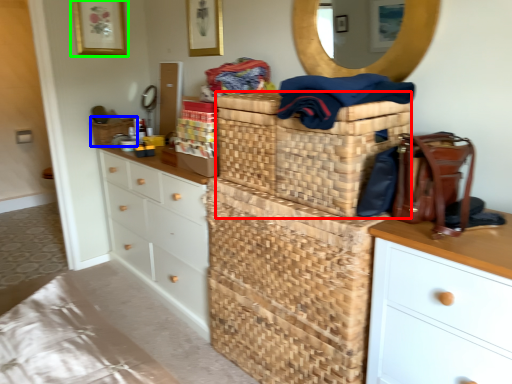
Question: Which object is positioned farthest from basket (highlighted by a red box)? Select from basket (highlighted by a blue box) and picture frame (highlighted by a green box).

Choices:
 (A) basket
 (B) picture frame

Answer: (B)